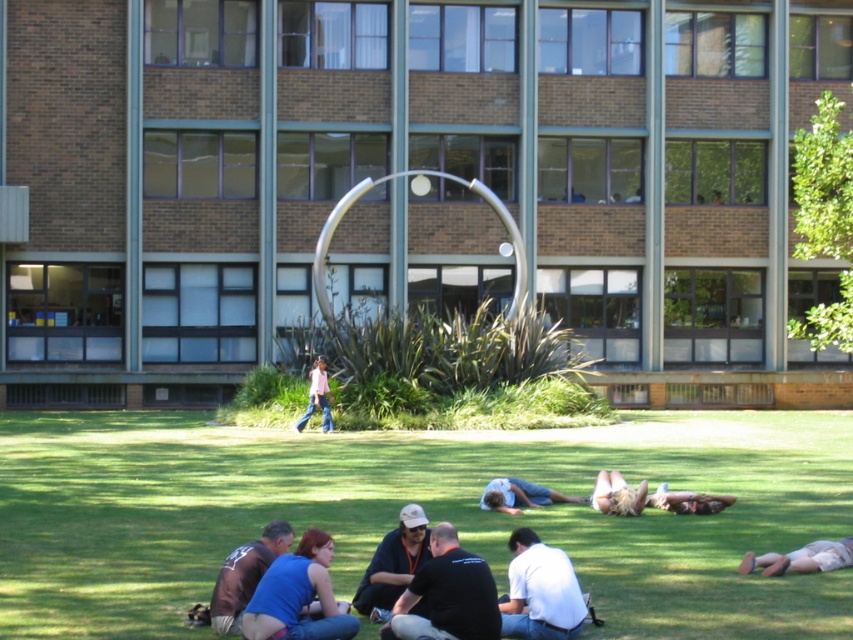
Question: Does dark gray shirt at center come behind dark blue shirt at lower center?

Choices:
 (A) no
 (B) yes

Answer: (A)

Question: Can you confirm if dark blue shirt at lower center is positioned above blonde hair at lower right?

Choices:
 (A) yes
 (B) no

Answer: (A)

Question: Which object is farther from the camera taking this photo?

Choices:
 (A) light blue denim jeans at lower center
 (B) blonde hair at lower right

Answer: (A)

Question: Can you confirm if white matte shirt at lower center is wider than light blue denim jeans at lower center?

Choices:
 (A) no
 (B) yes

Answer: (A)

Question: Which point appears farthest from the camera in this image?

Choices:
 (A) (514, 609)
 (B) (479, 500)
 (C) (158, 550)

Answer: (B)

Question: Which point is farther to the camera?

Choices:
 (A) brown leather jacket at lower left
 (B) dark gray shirt at center
 (C) white matte shirt at lower center

Answer: (A)